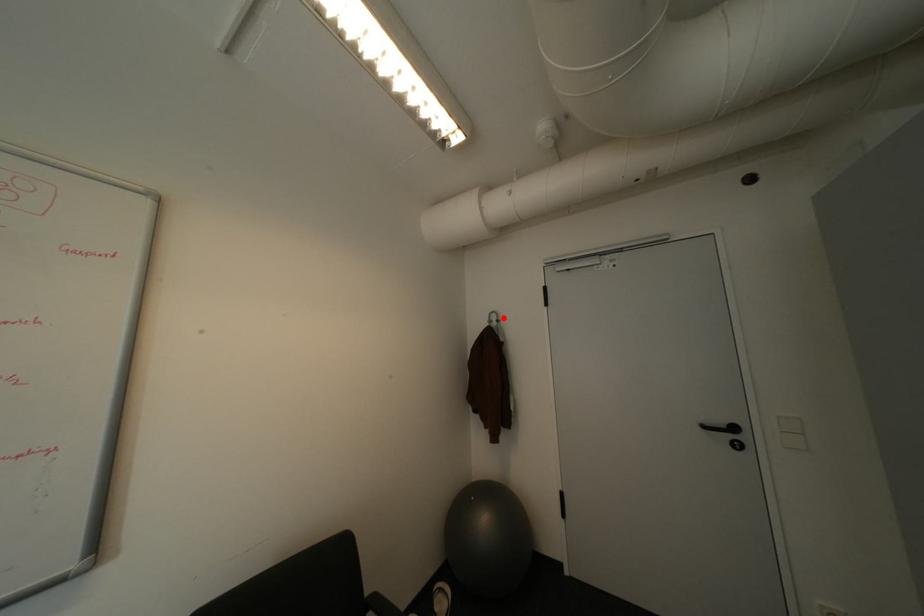
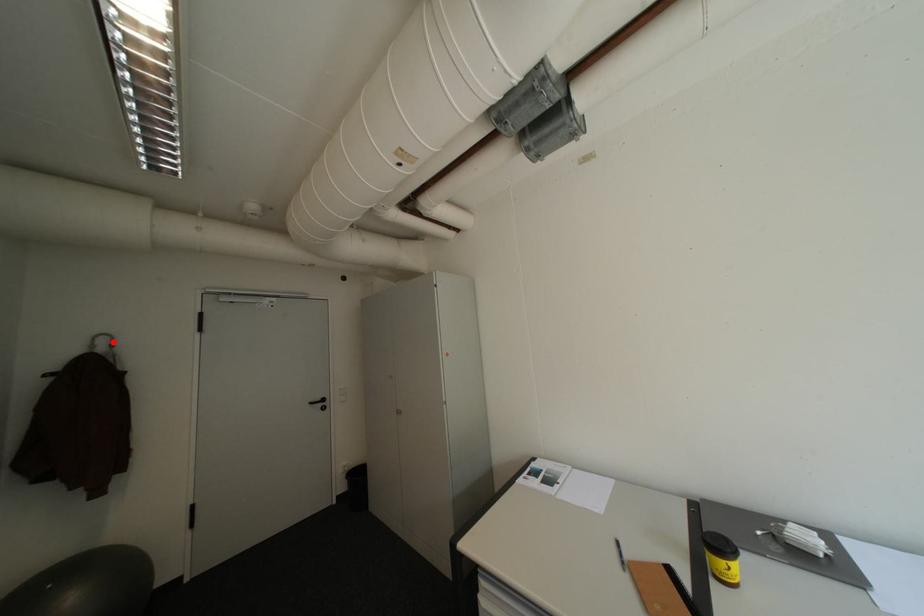
I am providing you with two images of the same scene from different viewpoints. A red point is marked on the first image and another point is marked on the second image. Are the points marked in image1 and image2 representing the same 3D position?

Yes